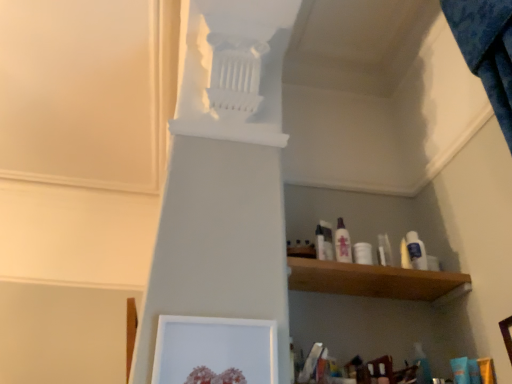
Question: Is the depth of white plastic bottle at upper right, which is the 3th toiletry in left-to-right order, greater than that of white matte picture frame at lower center?

Choices:
 (A) yes
 (B) no

Answer: (A)

Question: Does white plastic bottle at upper right, which is the 1th toiletry from right to left, have a lesser width compared to white matte picture frame at lower center?

Choices:
 (A) no
 (B) yes

Answer: (B)

Question: Is white plastic bottle at upper right, which is the 1th toiletry from right to left, bigger than white matte picture frame at lower center?

Choices:
 (A) yes
 (B) no

Answer: (B)

Question: Is white plastic bottle at upper right, which is the 1th toiletry from right to left, shorter than white matte picture frame at lower center?

Choices:
 (A) no
 (B) yes

Answer: (B)

Question: Is white plastic bottle at upper right, which is the 1th toiletry from right to left, aimed at white matte picture frame at lower center?

Choices:
 (A) no
 (B) yes

Answer: (A)

Question: Is white plastic bottle at upper right, which is the 3th toiletry in left-to-right order, inside or outside of white matte picture frame at lower center?

Choices:
 (A) inside
 (B) outside

Answer: (B)

Question: In the image, is white plastic bottle at upper right, which is the 3th toiletry in left-to-right order, on the left side or the right side of white matte picture frame at lower center?

Choices:
 (A) left
 (B) right

Answer: (B)

Question: Relative to white matte picture frame at lower center, is white plastic bottle at upper right, which is the 3th toiletry in left-to-right order, in front or behind?

Choices:
 (A) front
 (B) behind

Answer: (B)

Question: Considering the positions of white plastic bottle at upper right, which is the 3th toiletry in left-to-right order, and white matte picture frame at lower center in the image, is white plastic bottle at upper right, which is the 3th toiletry in left-to-right order, bigger or smaller than white matte picture frame at lower center?

Choices:
 (A) big
 (B) small

Answer: (B)

Question: Is white glossy lotion at upper center, the second toiletry when ordered from left to right, in front of or behind white matte picture frame at lower center in the image?

Choices:
 (A) behind
 (B) front

Answer: (A)

Question: From the image's perspective, is white glossy lotion at upper center, placed as the second toiletry when sorted from right to left, located above or below white matte picture frame at lower center?

Choices:
 (A) above
 (B) below

Answer: (A)

Question: Considering the positions of white glossy lotion at upper center, the second toiletry when ordered from left to right, and white matte picture frame at lower center in the image, is white glossy lotion at upper center, the second toiletry when ordered from left to right, wider or thinner than white matte picture frame at lower center?

Choices:
 (A) wide
 (B) thin

Answer: (A)

Question: Considering the positions of white glossy lotion at upper center, the second toiletry when ordered from left to right, and white matte picture frame at lower center in the image, is white glossy lotion at upper center, the second toiletry when ordered from left to right, taller or shorter than white matte picture frame at lower center?

Choices:
 (A) short
 (B) tall

Answer: (A)

Question: From a real-world perspective, is white plastic bottle at center, placed as the first toiletry when sorted from left to right, physically located above or below white glossy lotion at upper center, the second toiletry when ordered from left to right?

Choices:
 (A) below
 (B) above

Answer: (A)

Question: Based on their sizes in the image, would you say white plastic bottle at center, placed as the first toiletry when sorted from left to right, is bigger or smaller than white glossy lotion at upper center, placed as the second toiletry when sorted from right to left?

Choices:
 (A) big
 (B) small

Answer: (B)